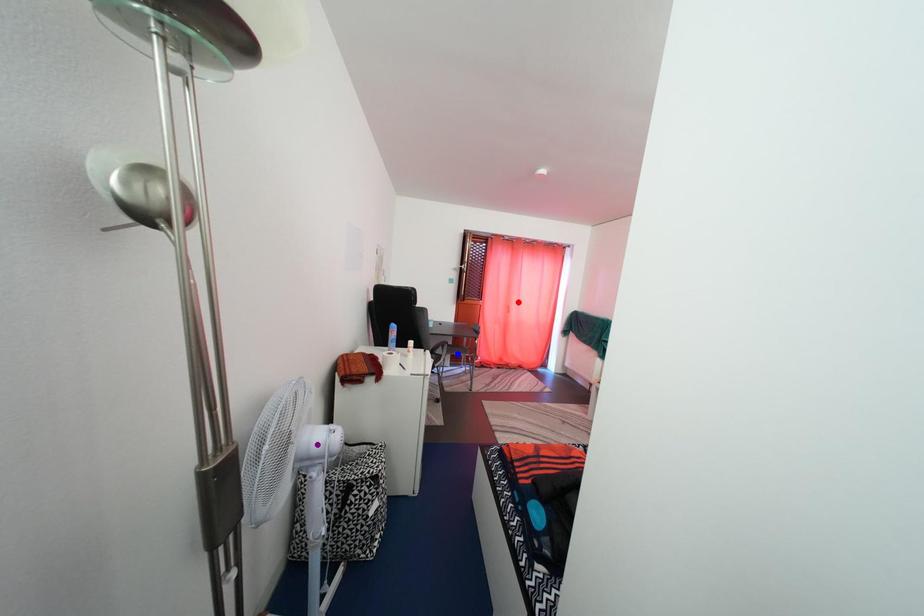
Order these from nearest to farthest:
1. blue point
2. red point
3. purple point

purple point
blue point
red point